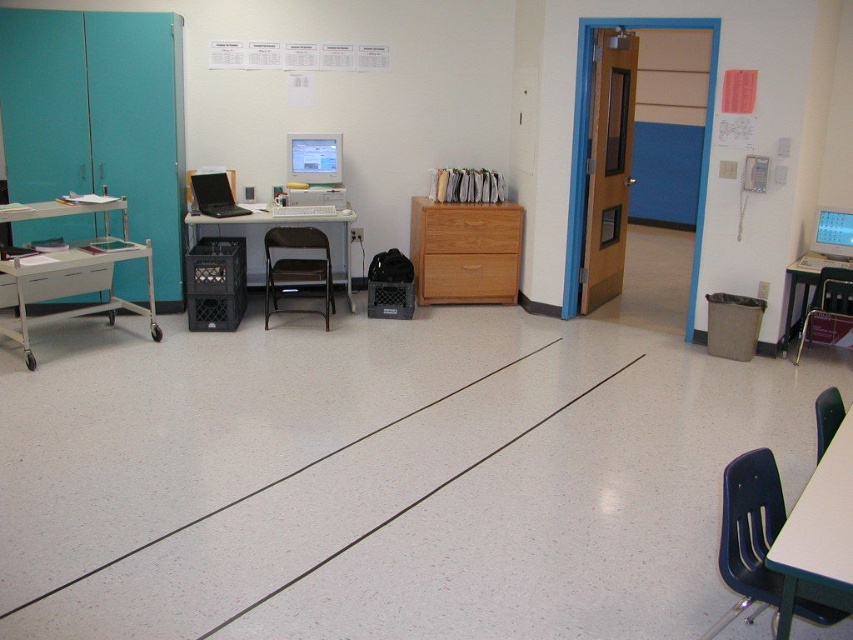
Question: Which object is closer to the camera taking this photo?

Choices:
 (A) matte gray monitor at center
 (B) metallic silver cart at left
 (C) black plastic chair at lower right
 (D) wooden cabinet at center

Answer: (C)

Question: Can you confirm if matte blue plastic chair at lower right is positioned above matte black computer desk at right?

Choices:
 (A) no
 (B) yes

Answer: (A)

Question: Is white plastic table at lower right thinner than matte gray monitor at right?

Choices:
 (A) yes
 (B) no

Answer: (B)

Question: Which point appears farthest from the camera in this image?

Choices:
 (A) (819, 243)
 (B) (479, 218)
 (C) (322, 156)

Answer: (C)

Question: Which object appears closest to the camera in this image?

Choices:
 (A) black metal folding chair at center
 (B) metallic silver cart at left

Answer: (B)

Question: Can you confirm if matte blue plastic chair at lower right is positioned above matte black desk at center?

Choices:
 (A) yes
 (B) no

Answer: (B)